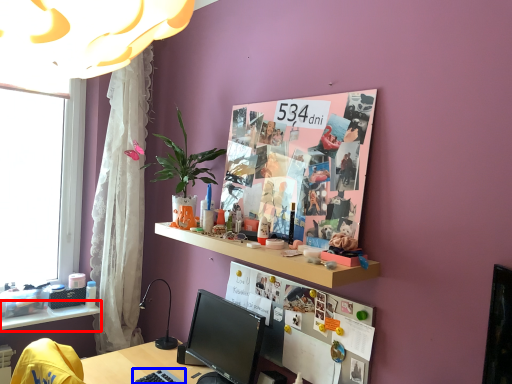
Question: Which of the following is the closest to the observer, shelf (highlighted by a red box) or keyboard (highlighted by a blue box)?

Choices:
 (A) shelf
 (B) keyboard

Answer: (B)